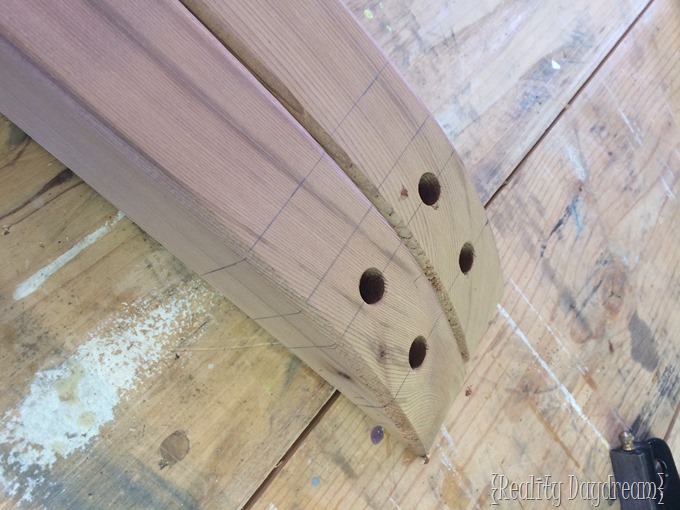
Find the location of `wooden surface`. wooden surface is located at coordinates (483, 48), (562, 244).